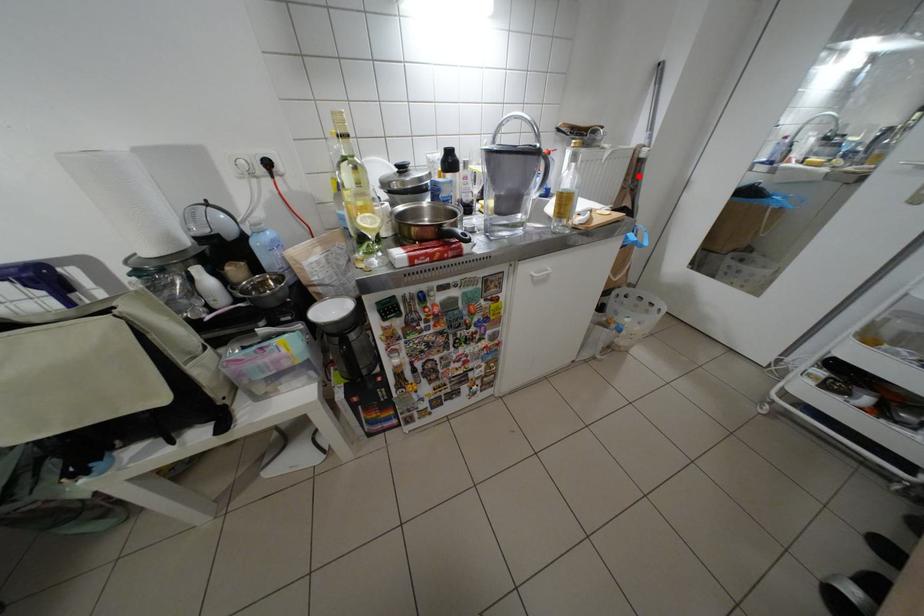
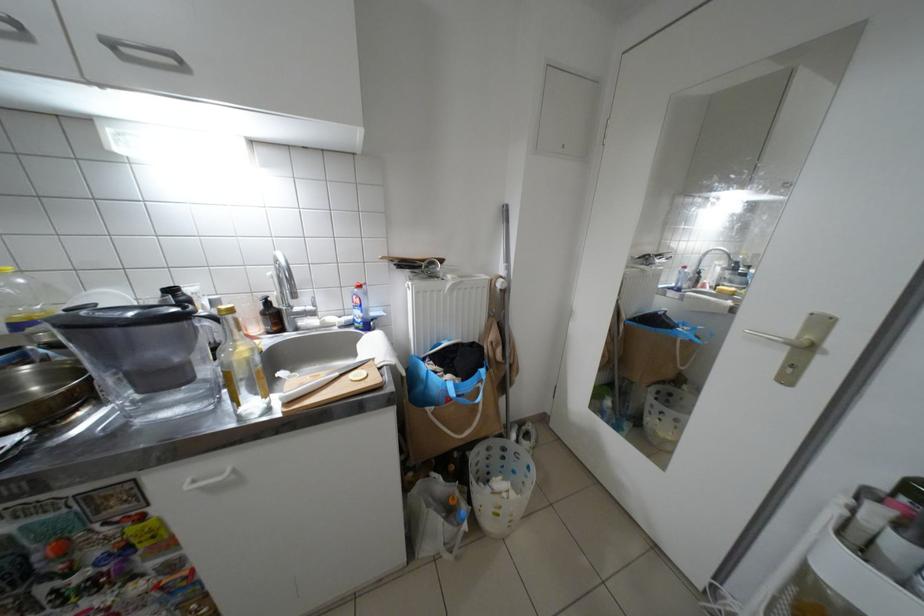
Find the pixel in the second image that matches the highlighted location in the first image.

(502, 304)